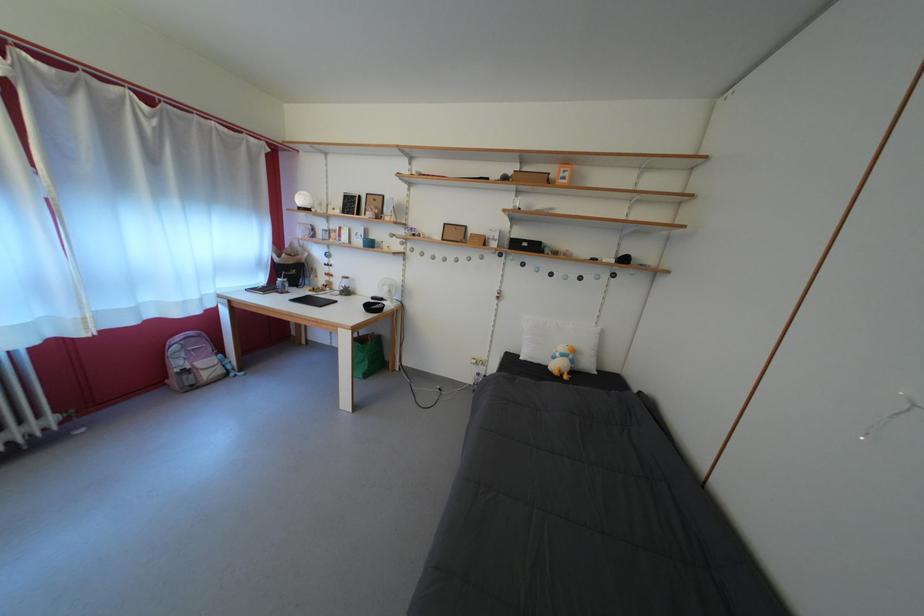
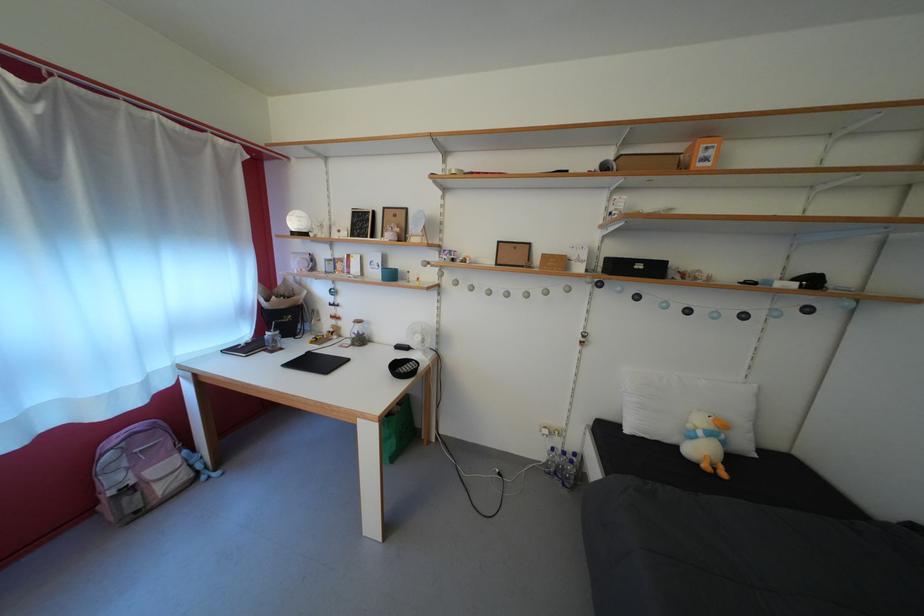
In the second image, find the point that corresponds to point (565, 361) in the first image.

(709, 439)